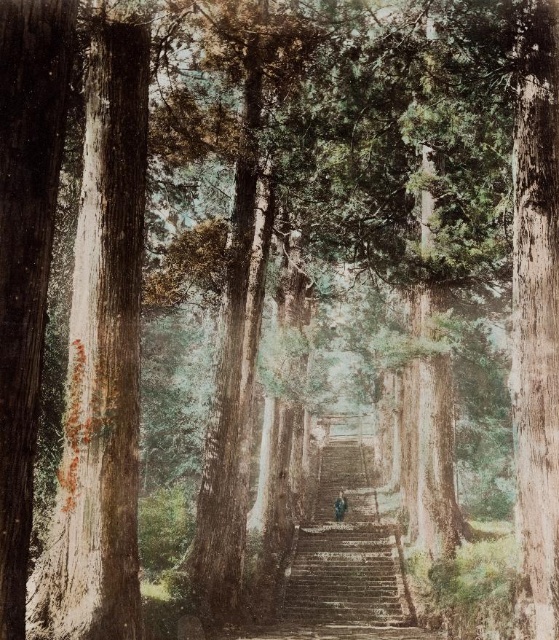
You are a hiker who has just spotted a smooth brown bark at left and a brown leather jacket at center in the forest. Which object is taller?

The smooth brown bark at left is much taller than the brown leather jacket at center.